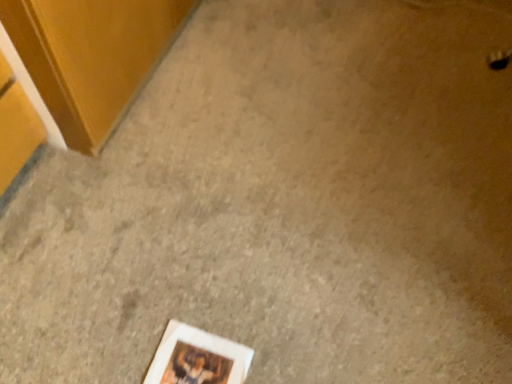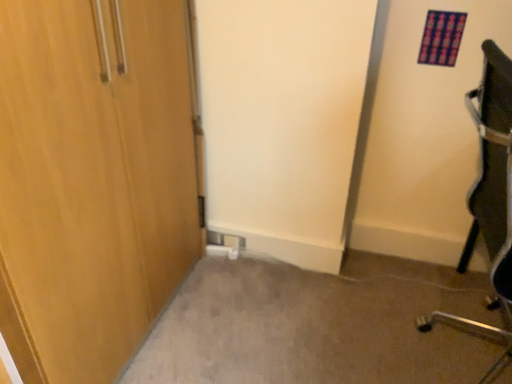
Question: Which way did the camera rotate in the video?

Choices:
 (A) rotated downward
 (B) rotated upward

Answer: (B)